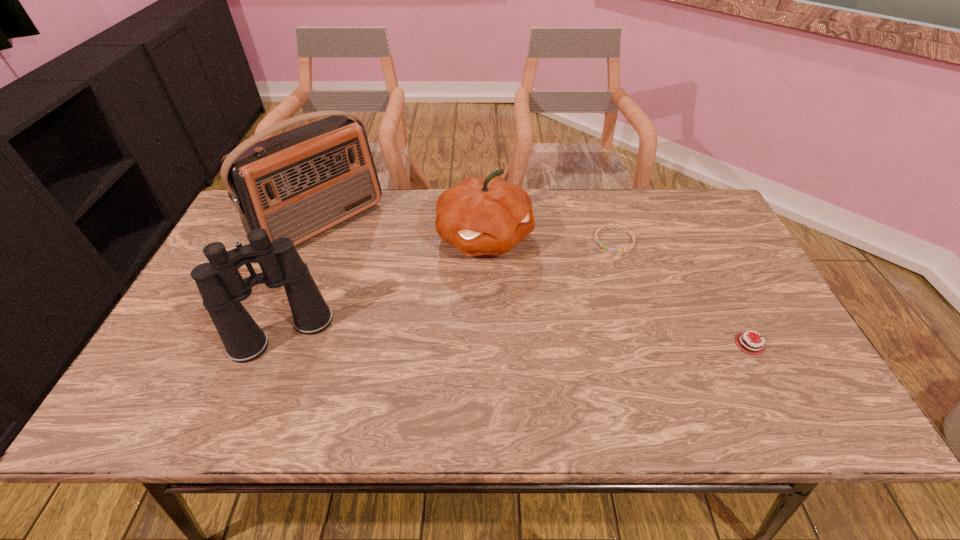
Identify the location of vacant space at the far edge of the desktop. The image size is (960, 540). (596, 202).

The height and width of the screenshot is (540, 960). Identify the location of vacant region at the near edge of the desktop. [356, 354].

In the image, there is a desktop. Where is `vacant space at the left edge`? vacant space at the left edge is located at coordinates (256, 266).

What are the coordinates of `free space at the right edge of the desktop` in the screenshot? It's located at (729, 242).

The image size is (960, 540). In order to click on free region at the far left corner of the desktop in this screenshot , I will do `click(236, 231)`.

This screenshot has height=540, width=960. I want to click on free location at the far right corner, so click(x=700, y=192).

At what (x,y) coordinates should I click in order to perform the action: click on vacant area that lies between the shortest object and the pumpkin. Please return your answer as a coordinate pair (x, y). Image resolution: width=960 pixels, height=540 pixels. Looking at the image, I should click on (549, 239).

I want to click on vacant area between the chocolate cake and the binoculars, so click(x=516, y=339).

I want to click on free space that is in between the binoculars and the pumpkin, so click(383, 286).

Find the location of `free point between the chocolate cake and the radio receiver`. free point between the chocolate cake and the radio receiver is located at coordinates (536, 284).